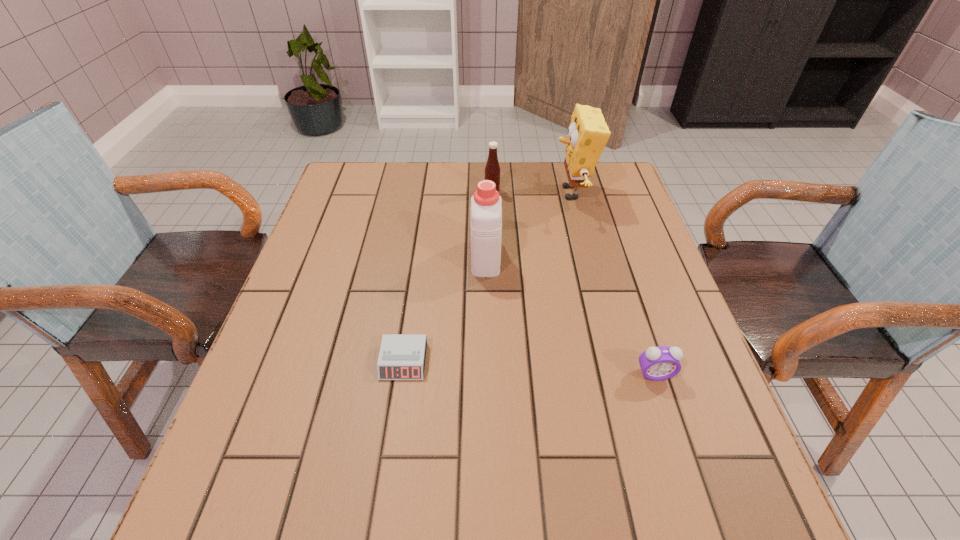
Identify the location of free point located on the handle side of the third nearest object. Image resolution: width=960 pixels, height=540 pixels. (485, 171).

This screenshot has width=960, height=540. In order to click on free location located on the handle side of the third nearest object in this screenshot , I will do `click(485, 171)`.

What are the coordinates of `vacant space situated 0.300m on the handle side of the third nearest object` in the screenshot? It's located at (485, 176).

The height and width of the screenshot is (540, 960). Identify the location of vacant space situated on the front of the third tallest object. (492, 215).

I want to click on free space located 0.130m on the face of the right alarm clock, so click(678, 447).

At what (x,y) coordinates should I click in order to perform the action: click on free space located 0.360m on the back of the left alarm clock. Please return your answer as a coordinate pair (x, y). Looking at the image, I should click on (422, 233).

The image size is (960, 540). I want to click on sponge positioned at the far edge, so click(588, 133).

Where is `Tabasco sauce that is positioned at the far edge`? Tabasco sauce that is positioned at the far edge is located at coordinates coord(492,169).

The height and width of the screenshot is (540, 960). What are the coordinates of `sponge located in the right edge section of the desktop` in the screenshot? It's located at (588, 133).

The width and height of the screenshot is (960, 540). Identify the location of alarm clock at the right edge. (658, 363).